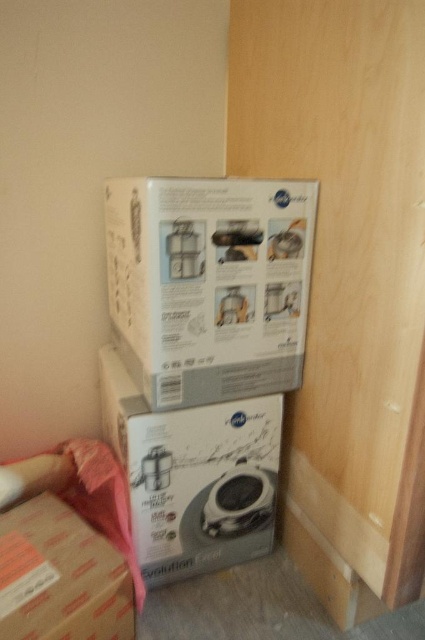
Question: Is the position of white glossy box at center more distant than that of matte white appliance at lower center?

Choices:
 (A) no
 (B) yes

Answer: (A)

Question: Does white glossy box at center appear under matte white appliance at lower center?

Choices:
 (A) yes
 (B) no

Answer: (B)

Question: Can you confirm if white glossy box at center is positioned to the right of brown cardboard at lower left?

Choices:
 (A) no
 (B) yes

Answer: (B)

Question: Which object is closer to the camera taking this photo?

Choices:
 (A) white glossy box at center
 (B) matte white appliance at lower center
 (C) white matte box at upper left

Answer: (C)

Question: Which point is closer to the camera?

Choices:
 (A) (223, 496)
 (B) (121, 634)
 (C) (280, 326)

Answer: (B)

Question: Which point appears farthest from the camera in this image?

Choices:
 (A) (181, 288)
 (B) (19, 573)

Answer: (A)